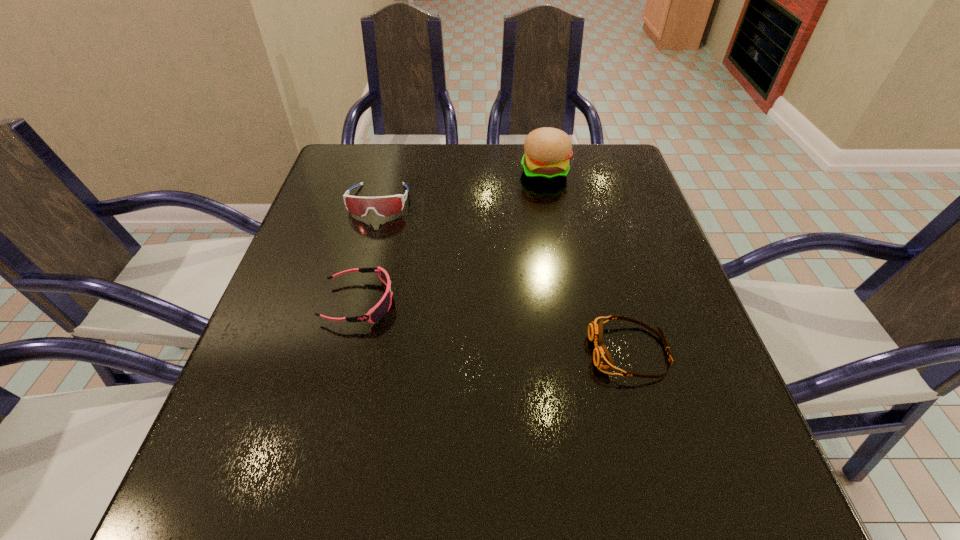
This screenshot has width=960, height=540. I want to click on goggles that can be found as the third closest to the hamburger, so click(x=602, y=359).